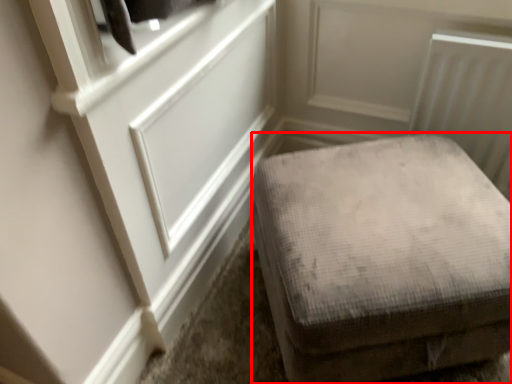
Question: From the image's perspective, where is furniture (annotated by the red box) located relative to door?

Choices:
 (A) above
 (B) below

Answer: (B)